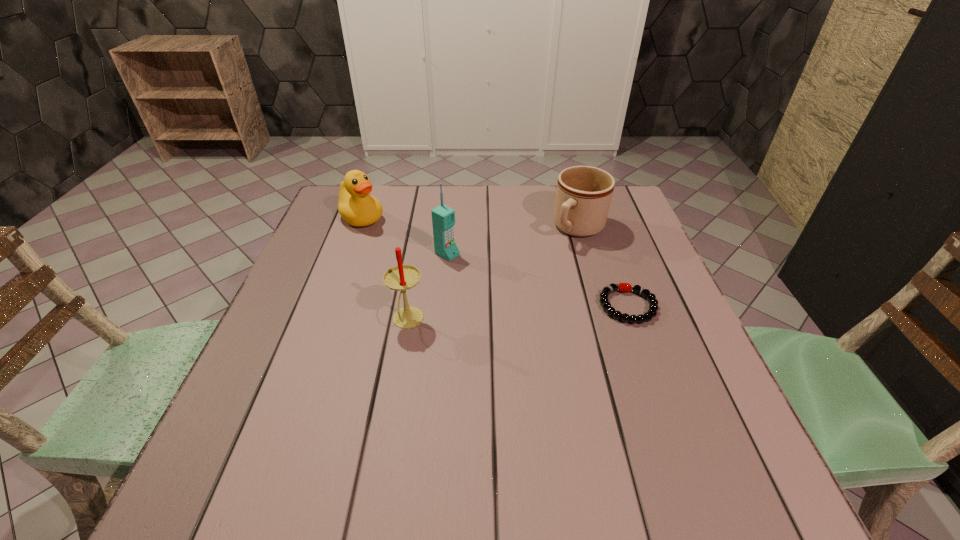
The height and width of the screenshot is (540, 960). Identify the location of free space on the desktop that is between the fourth object from right to left and the shortest object and is positioned at the beak of the leftmost object. (496, 315).

At what (x,y) coordinates should I click in order to perform the action: click on free space on the desktop that is between the candle and the bracelet and is positioned on the side of the mug with the handle. Please return your answer as a coordinate pair (x, y). This screenshot has height=540, width=960. Looking at the image, I should click on (493, 315).

Where is `vacant space on the desktop that is between the candle and the shortest object and is positioned on the keypad of the cellular telephone`? vacant space on the desktop that is between the candle and the shortest object and is positioned on the keypad of the cellular telephone is located at coordinates (549, 312).